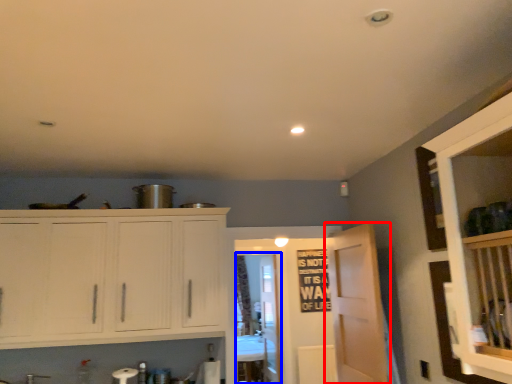
Question: Among these objects, which one is farthest to the camera, door (highlighted by a red box) or glass door (highlighted by a blue box)?

Choices:
 (A) door
 (B) glass door

Answer: (B)